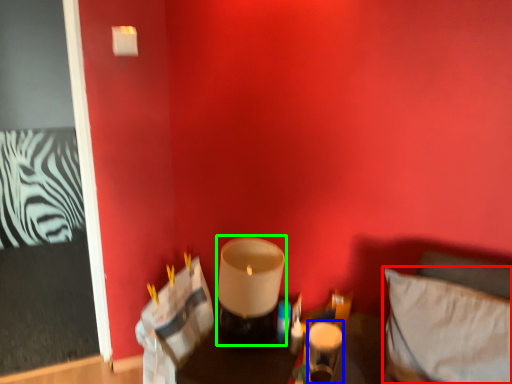
Question: Which object is the closest to the pillow (highlighted by a red box)? Choose among these: candle holder (highlighted by a blue box) or candle holder (highlighted by a green box).

Choices:
 (A) candle holder
 (B) candle holder

Answer: (A)